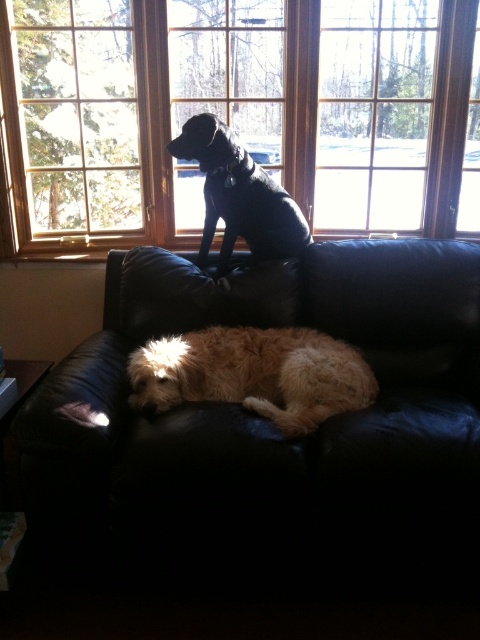
You are a dog trainer observing the two dogs on the couch. Which dog is sitting higher up on the couch, the fuzzy golden dog at lower center or the shiny black dog at upper center?

The shiny black dog at upper center is sitting higher up on the couch because it is positioned above the fuzzy golden dog at lower center.

Looking at this image, you have a small toy that is 12 inches long. You want to place it between the black leather couch at lower center and the wooden frame at upper center. Will the toy fit entirely within that space?

The space between the black leather couch at lower center and the wooden frame at upper center is 35.04 inches. Since the toy is only 12 inches long, it will fit entirely within that space.